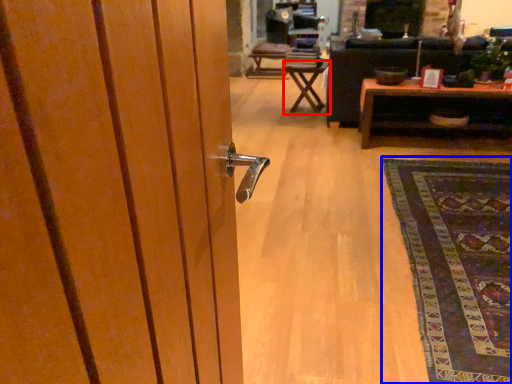
Question: Which object appears closest to the camera in this image, table (highlighted by a red box) or mat (highlighted by a blue box)?

Choices:
 (A) table
 (B) mat

Answer: (B)